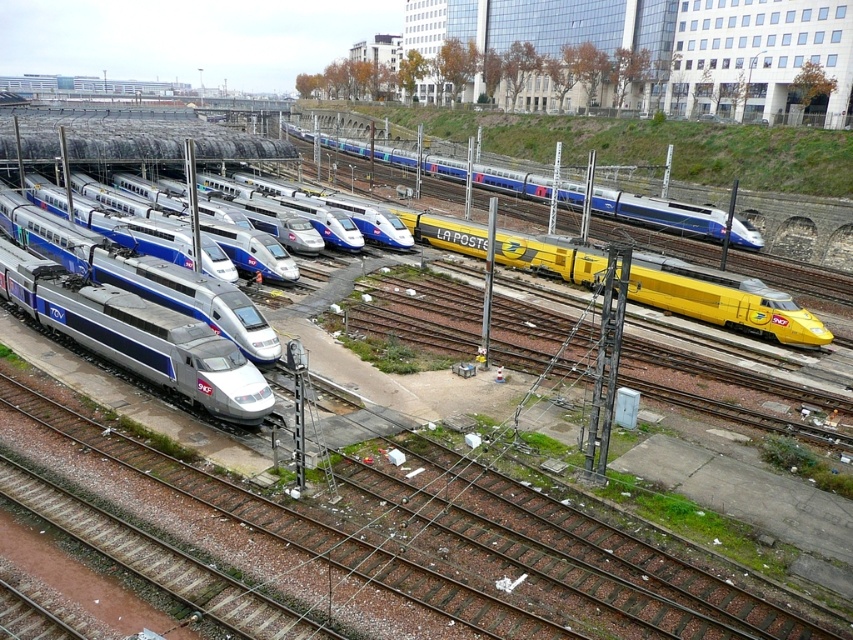
You are a railway worker checking the height clearance for a new overhead bridge being constructed over the tracks. You need to ensure that both the silver metallic train at left and the yellow metallic train at center can pass under it. According to the scene description, what is the minimum height the bridge must be to accommodate both trains?

The silver metallic train at left is not as tall as the yellow metallic train at center. Therefore, the bridge must be at least as tall as the yellow metallic train at center to ensure both can pass safely.

You are a railway worker who needs to load a cargo container that is 10 meters wide. You have to choose between placing it on the silver metallic train at left or the yellow metallic train at center. Based on their widths, which train can accommodate the cargo container?

The yellow metallic train at center has a greater width than the silver metallic train at left, so the cargo container can be placed on the yellow metallic train at center.

You are a railway worker who needs to move a new train into the yard. The new train is the same size as the silver metallic train at left. There is a space available where the yellow metallic train at center is currently parked. Can the new train fit into that space?

The silver metallic train at left occupies less space than the yellow metallic train at center. Therefore, the new train, being the same size as the silver metallic train at left, can fit into the space currently occupied by the yellow metallic train at center since it is larger.